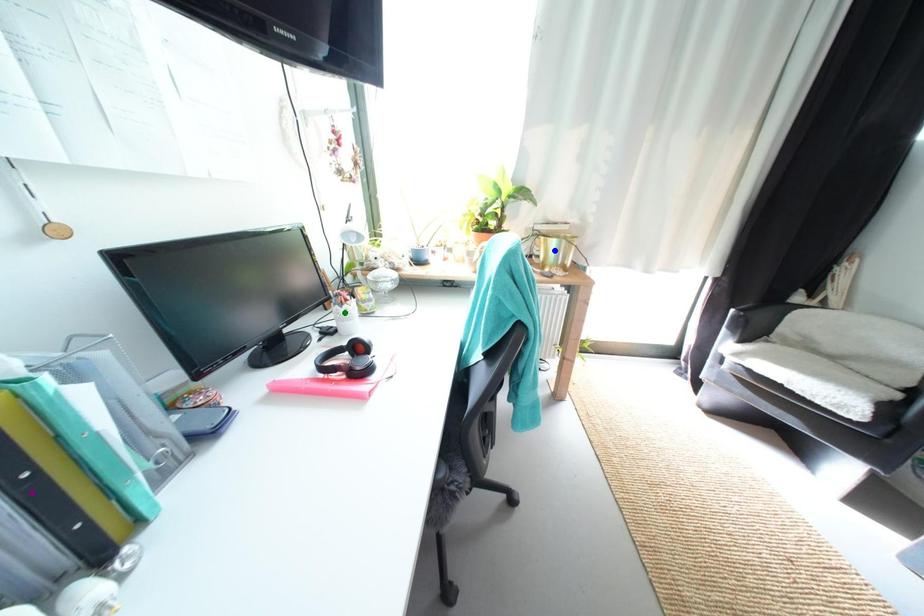
Order these from nearest to farthest:
A) blue point
B) green point
C) purple point

purple point < green point < blue point